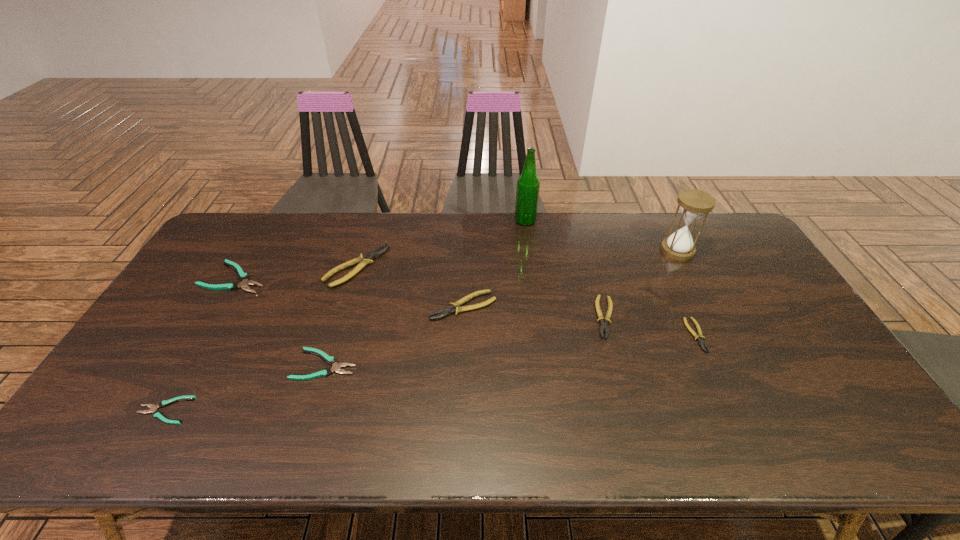
The width and height of the screenshot is (960, 540). What are the coordinates of `pliers present at the far edge` in the screenshot? It's located at (363, 260).

Locate an element on the screen. The image size is (960, 540). object that is at the near edge is located at coordinates (153, 408).

The height and width of the screenshot is (540, 960). Identify the location of object that is at the near left corner. (153, 408).

In the image, there is a desktop. Where is `free region at the far edge`? This screenshot has width=960, height=540. free region at the far edge is located at coordinates (462, 230).

This screenshot has height=540, width=960. Find the location of `free space at the near edge`. free space at the near edge is located at coordinates [675, 455].

Locate an element on the screen. This screenshot has width=960, height=540. free location at the right edge is located at coordinates (798, 347).

The height and width of the screenshot is (540, 960). What are the coordinates of `vacant area at the near left corner of the desktop` in the screenshot? It's located at tap(97, 427).

Locate an element on the screen. Image resolution: width=960 pixels, height=540 pixels. vacant space at the far right corner is located at coordinates (713, 219).

Find the location of a particular element. vacant area that lies between the green beer bottle and the tallest pliers is located at coordinates (441, 244).

At what (x,y) coordinates should I click in order to perform the action: click on free space between the second smallest yellow pliers and the rightmost yellow pliers. Please return your answer as a coordinate pair (x, y). The height and width of the screenshot is (540, 960). Looking at the image, I should click on (651, 326).